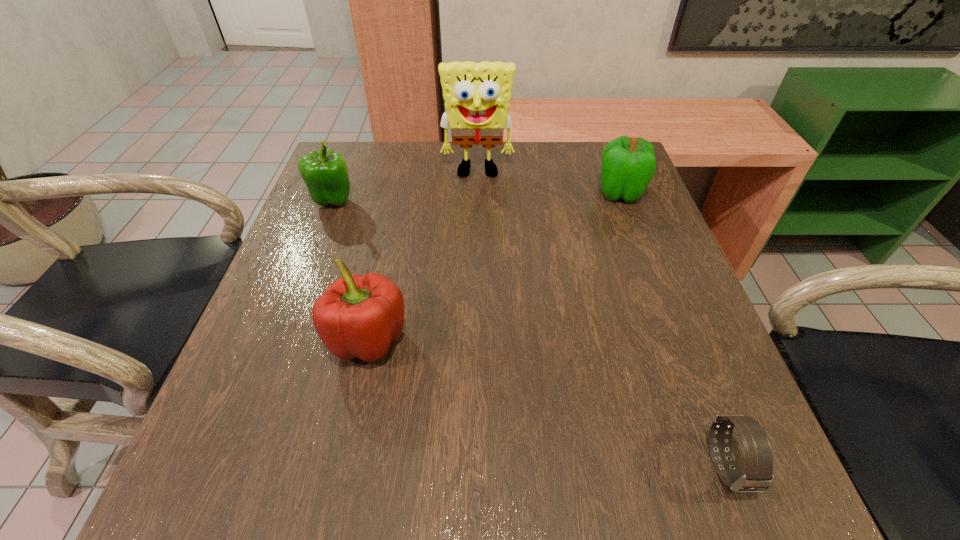
The height and width of the screenshot is (540, 960). I want to click on free space between the sponge and the leftmost object, so click(405, 187).

Identify the location of empty space that is in between the rightmost bell pepper and the fourth object from right to left. (494, 266).

Where is `vacant point located between the rightmost bell pepper and the leftmost bell pepper`? vacant point located between the rightmost bell pepper and the leftmost bell pepper is located at coordinates (476, 197).

The width and height of the screenshot is (960, 540). Find the location of `empty space between the fourth object from right to left and the tallest object`. empty space between the fourth object from right to left and the tallest object is located at coordinates (422, 256).

Where is `vacant region between the rightmost bell pepper and the leftmost object`? This screenshot has width=960, height=540. vacant region between the rightmost bell pepper and the leftmost object is located at coordinates (476, 197).

Where is `object that is the closest to the watch`? The width and height of the screenshot is (960, 540). object that is the closest to the watch is located at coordinates (358, 316).

At what (x,y) coordinates should I click in order to perform the action: click on object that is the closest to the shortest object. Please return your answer as a coordinate pair (x, y). Looking at the image, I should click on (358, 316).

Select which bell pepper appears as the closest to the fourth farthest object. Please provide its 2D coordinates. Your answer should be formatted as a tuple, i.e. [(x, y)], where the tuple contains the x and y coordinates of a point satisfying the conditions above.

[(325, 173)]

Locate which bell pepper ranks in proximity to the leftmost bell pepper. Please provide its 2D coordinates. Your answer should be formatted as a tuple, i.e. [(x, y)], where the tuple contains the x and y coordinates of a point satisfying the conditions above.

[(358, 316)]

I want to click on vacant space that satisfies the following two spatial constraints: 1. on the face of the third object from left to right; 2. on the left side of the rightmost bell pepper, so click(x=477, y=193).